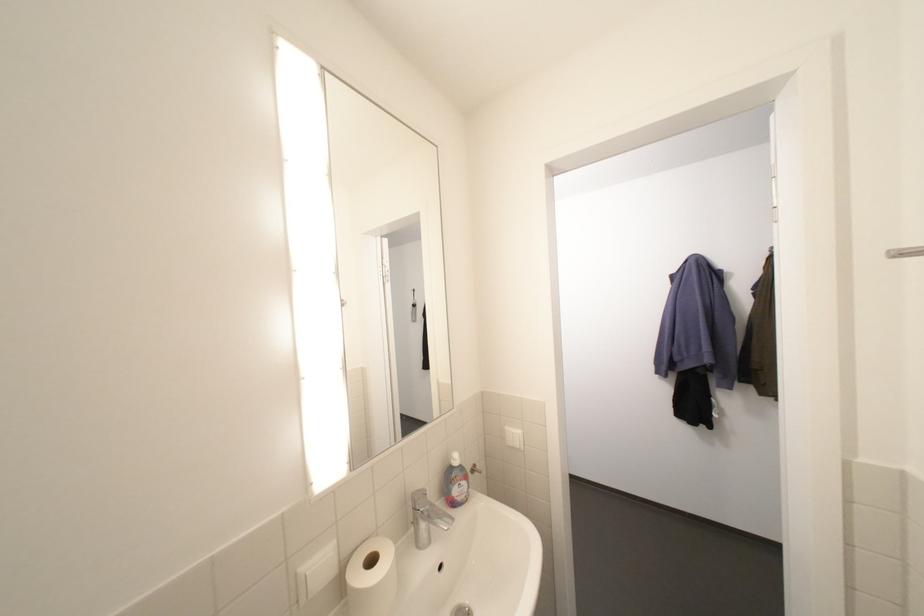
Where would you hang the black wall hook? Please return your answer as a coordinate pair (x, y).

(412, 307)